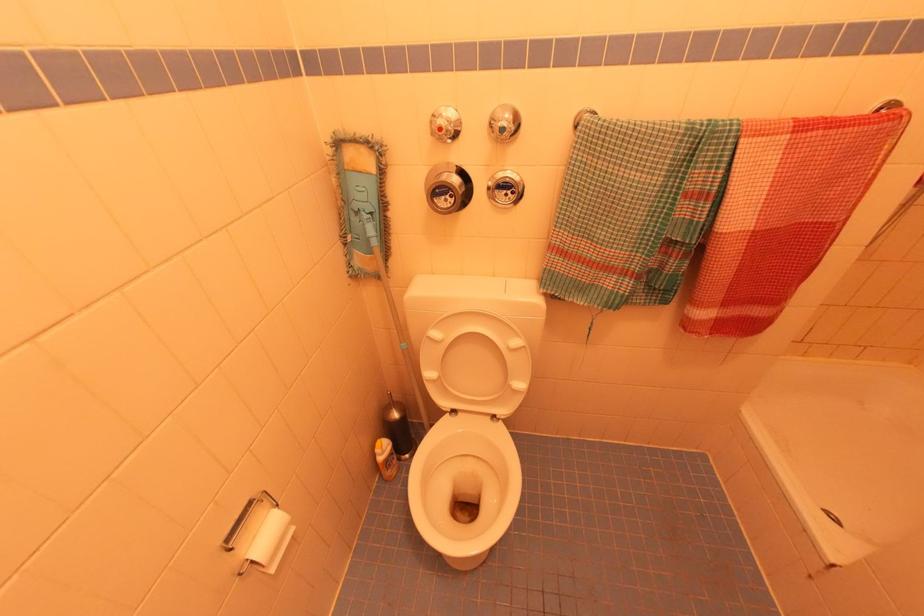
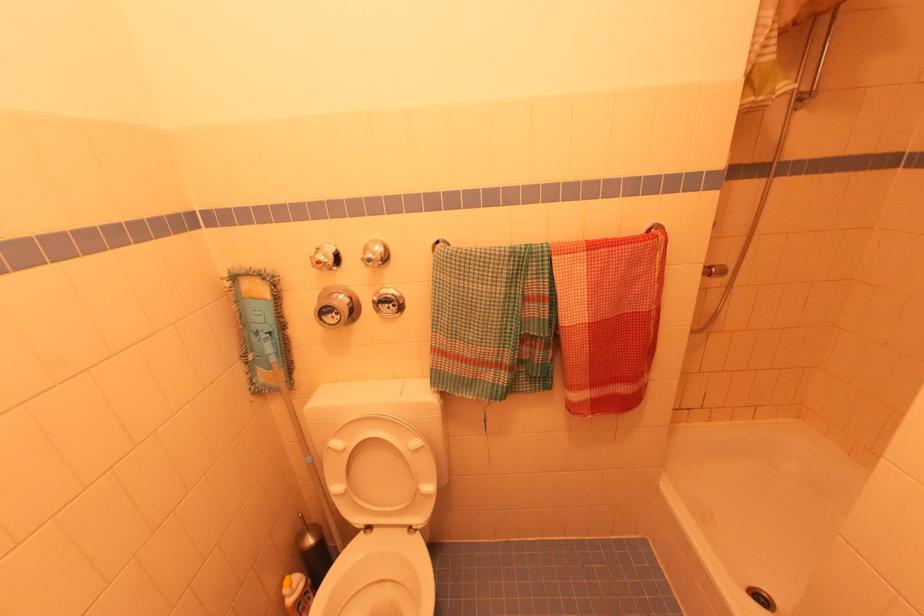
In the second image, find the point that corresponds to (505,108) in the first image.

(377, 243)